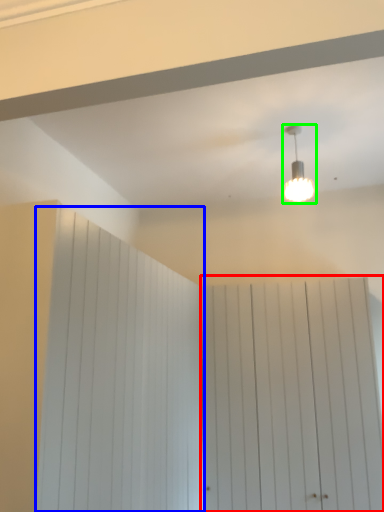
Question: Which is farther away from barn door (highlighted by a red box)? barn door (highlighted by a blue box) or lamp (highlighted by a green box)?

Choices:
 (A) barn door
 (B) lamp

Answer: (B)